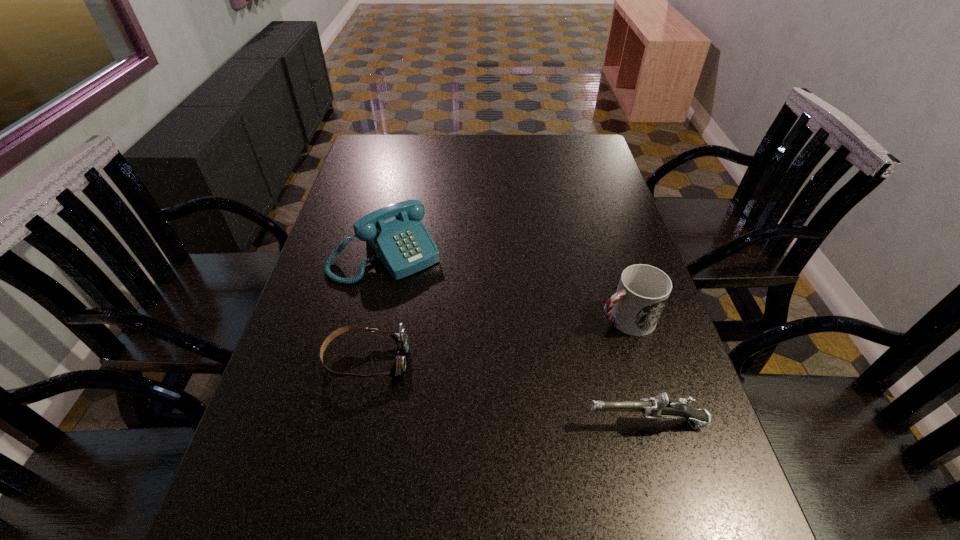
Image resolution: width=960 pixels, height=540 pixels. Find the location of `vacant space on the desktop that is between the shortest object and the gun and is positioned on the handle side of the cup`. vacant space on the desktop that is between the shortest object and the gun and is positioned on the handle side of the cup is located at coordinates (473, 383).

Find the location of a particular element. The width and height of the screenshot is (960, 540). free space on the desktop that is between the shortest object and the gun and is positioned on the dial of the telephone is located at coordinates (492, 388).